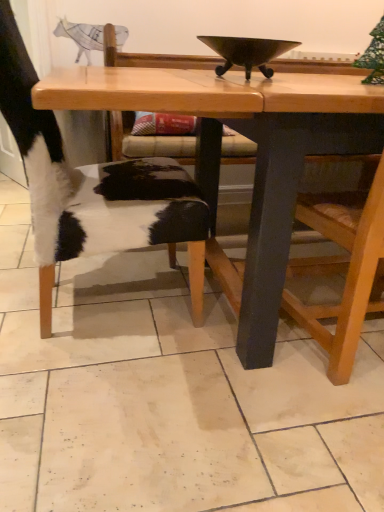
Identify the location of free space between wooden chair at right and wooden table at center. This screenshot has width=384, height=512. (235, 398).